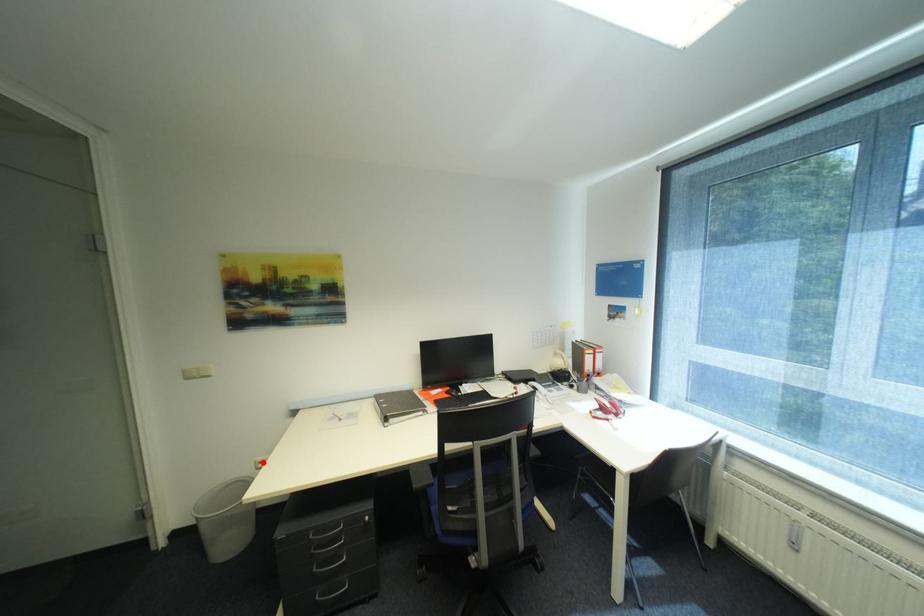
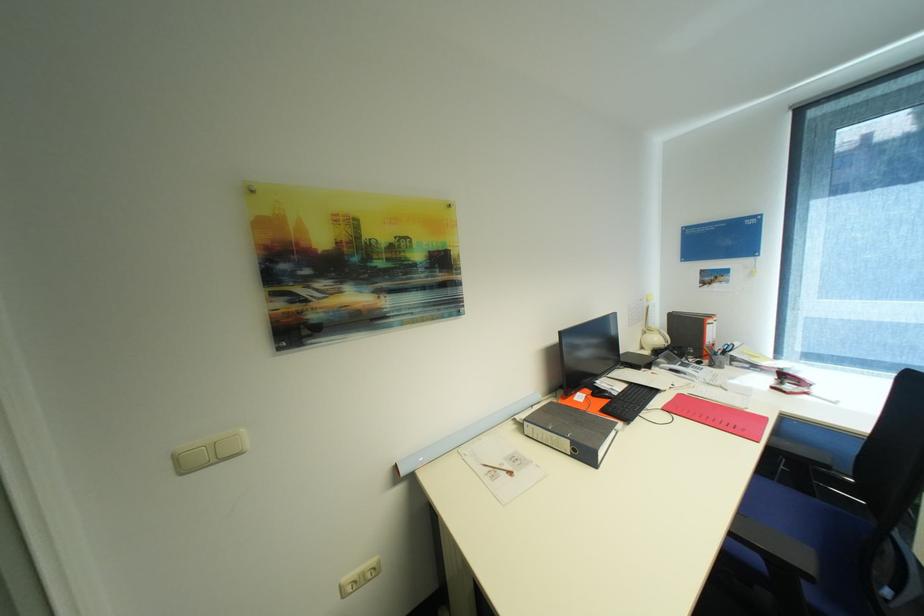
Question: I am providing you with two images of the same scene from different viewpoints. A red point is marked on the first image. Can you still see the location of the red point in image 2?

Choices:
 (A) Yes
 (B) No

Answer: (A)